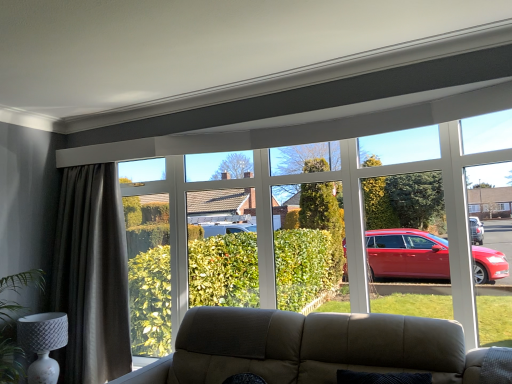
Question: Is white textured lamp at lower left positioned beyond the bounds of dark grey textured curtain at left?

Choices:
 (A) yes
 (B) no

Answer: (A)

Question: Is white textured lamp at lower left thinner than dark grey textured curtain at left?

Choices:
 (A) yes
 (B) no

Answer: (B)

Question: Does white textured lamp at lower left have a greater height compared to dark grey textured curtain at left?

Choices:
 (A) no
 (B) yes

Answer: (A)

Question: Is white textured lamp at lower left next to dark grey textured curtain at left?

Choices:
 (A) yes
 (B) no

Answer: (B)

Question: Is white textured lamp at lower left not near dark grey textured curtain at left?

Choices:
 (A) no
 (B) yes

Answer: (A)

Question: From a real-world perspective, is dark grey textured curtain at left physically located above or below white textured lamp at lower left?

Choices:
 (A) below
 (B) above

Answer: (B)

Question: Looking at the image, does dark grey textured curtain at left seem bigger or smaller compared to white textured lamp at lower left?

Choices:
 (A) big
 (B) small

Answer: (A)

Question: In terms of height, does dark grey textured curtain at left look taller or shorter compared to white textured lamp at lower left?

Choices:
 (A) short
 (B) tall

Answer: (B)

Question: Which is correct: dark grey textured curtain at left is inside white textured lamp at lower left, or outside of it?

Choices:
 (A) inside
 (B) outside

Answer: (B)

Question: From a real-world perspective, is white textured lamp at lower left positioned above or below transparent glass bay window at upper center?

Choices:
 (A) above
 (B) below

Answer: (B)

Question: Is point (44, 312) positioned closer to the camera than point (345, 266)?

Choices:
 (A) closer
 (B) farther

Answer: (A)

Question: Considering the positions of white textured lamp at lower left and transparent glass bay window at upper center in the image, is white textured lamp at lower left wider or thinner than transparent glass bay window at upper center?

Choices:
 (A) thin
 (B) wide

Answer: (A)

Question: From the image's perspective, is white textured lamp at lower left above or below transparent glass bay window at upper center?

Choices:
 (A) above
 (B) below

Answer: (B)

Question: From the image's perspective, relative to transparent glass bay window at upper center, is dark grey textured curtain at left above or below?

Choices:
 (A) below
 (B) above

Answer: (A)

Question: From a real-world perspective, relative to transparent glass bay window at upper center, is dark grey textured curtain at left vertically above or below?

Choices:
 (A) above
 (B) below

Answer: (B)